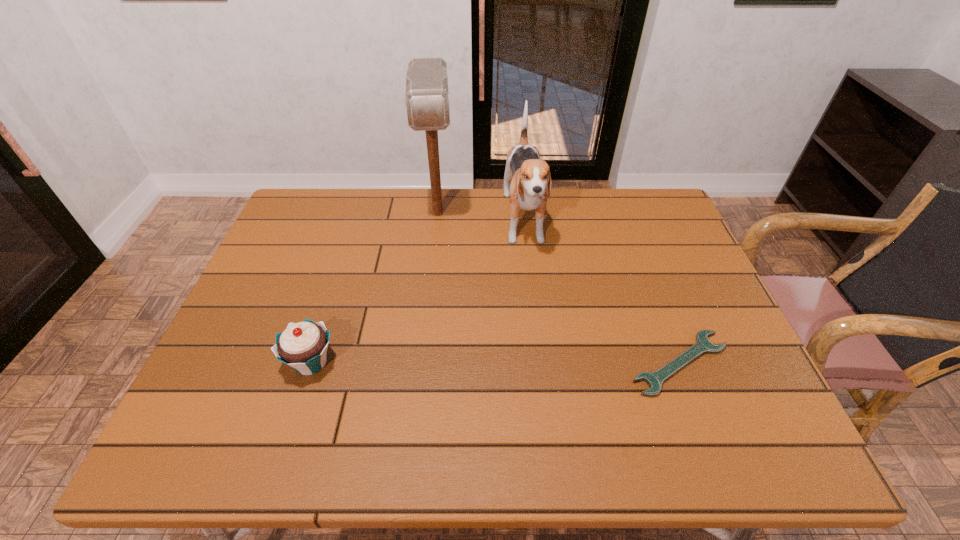
Identify the location of vacant space on the desktop that is between the cupcake and the wrench and is positioned at the face of the second tallest object. The width and height of the screenshot is (960, 540). (544, 363).

Find the location of a particular element. Image resolution: width=960 pixels, height=540 pixels. free space on the desktop that is between the cupcake and the rightmost object and is positioned above the head of the mallet is located at coordinates (441, 363).